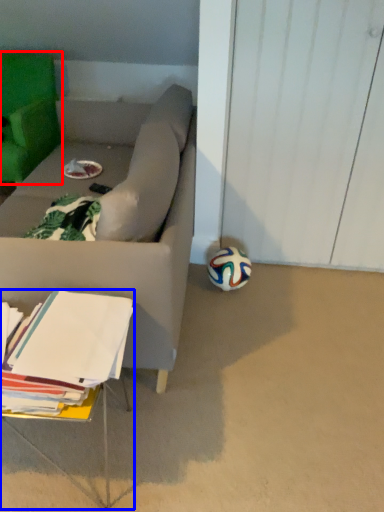
Question: Which of the following is the farthest to the observer, chair (highlighted by a red box) or table (highlighted by a blue box)?

Choices:
 (A) chair
 (B) table

Answer: (A)